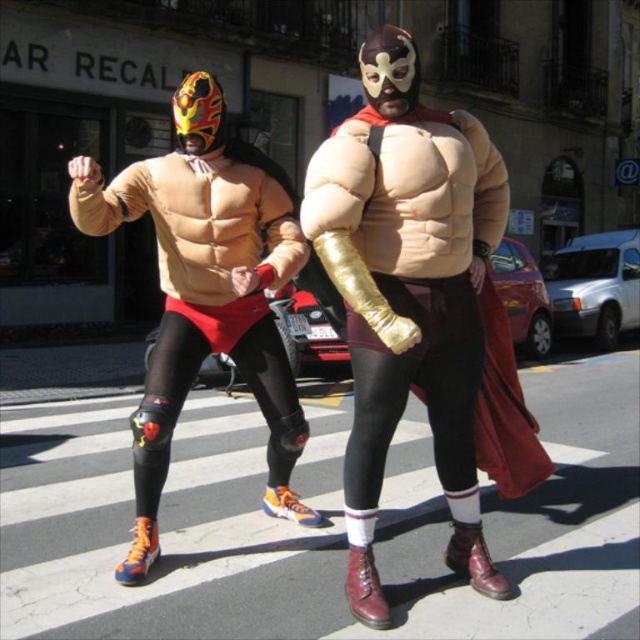
You are a pedestrian trying to cross the street and notice the matte gold arm at center and the matte orange athletic shoe at left. Which object is closer to you?

The matte gold arm at center is positioned over the matte orange athletic shoe at left, so the matte gold arm at center is closer to you.

You are a photographer trying to capture a photo of the two luchadores on the pedestrian crossing. You want to ensure that both points, point (467, 512) and point (257, 296), are in focus. Which point should you focus on to ensure both are sharp?

You should focus on point (467, 512) because it is closer to the viewer than point (257, 296). By focusing on the closer point, the depth of field will extend further back, increasing the likelihood that both points are in focus.

You are a photographer trying to capture a closeup of the matte gold arm at center and the matte orange athletic shoe at left. Which object should you zoom in on first to ensure it fits entirely in the frame?

The matte gold arm at center occupies less space than the matte orange athletic shoe at left, so you should zoom in on the matte orange athletic shoe at left first to ensure it fits entirely in the frame before adjusting for the smaller matte gold arm at center.